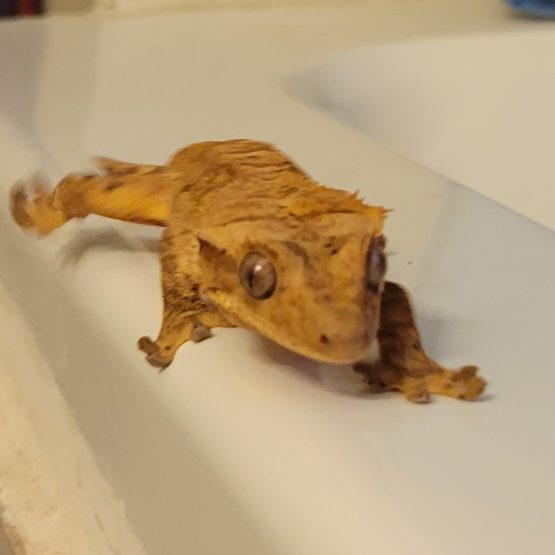
Where is `right front leg`? The image size is (555, 555). right front leg is located at coordinates (180, 317).